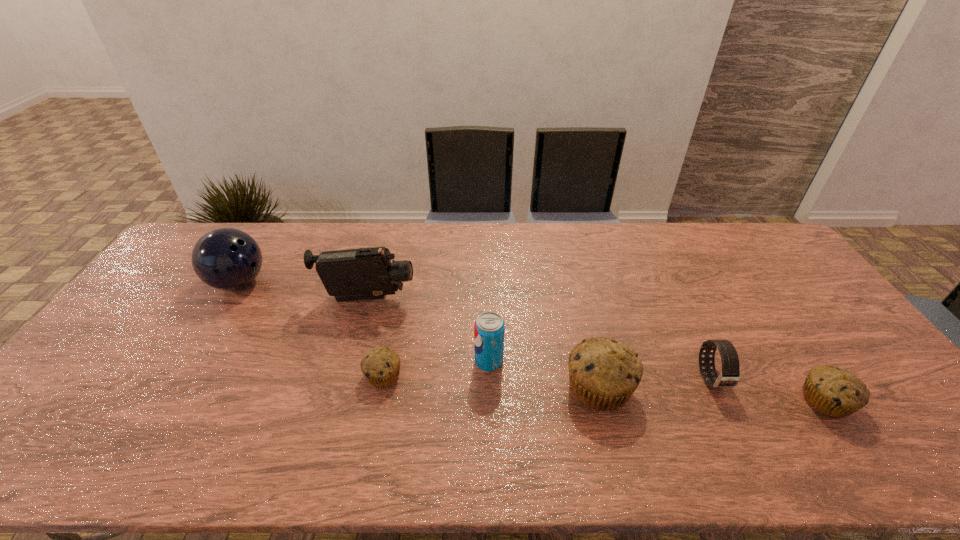
Image resolution: width=960 pixels, height=540 pixels. I want to click on object at the near right corner, so click(835, 392).

In the image, there is a desktop. At what (x,y) coordinates should I click in order to perform the action: click on vacant space at the far edge. Please return your answer as a coordinate pair (x, y). Looking at the image, I should click on (680, 263).

The image size is (960, 540). What are the coordinates of `vacant space at the near edge of the desktop` in the screenshot? It's located at (639, 414).

In the image, there is a desktop. Where is `blank space at the left edge`? The image size is (960, 540). blank space at the left edge is located at coordinates tap(126, 319).

I want to click on vacant space at the right edge of the desktop, so click(826, 354).

Where is `vacant area that lies between the second shortest object and the watch`? The height and width of the screenshot is (540, 960). vacant area that lies between the second shortest object and the watch is located at coordinates (768, 389).

This screenshot has height=540, width=960. Find the location of `free point between the camcorder and the fourth object from right to left`. free point between the camcorder and the fourth object from right to left is located at coordinates (428, 330).

At what (x,y) coordinates should I click in order to perform the action: click on empty space between the fourth object from right to left and the leftmost object. Please return your answer as a coordinate pair (x, y). Looking at the image, I should click on (364, 322).

The width and height of the screenshot is (960, 540). In order to click on vacant point located between the watch and the camcorder in this screenshot , I will do `click(539, 339)`.

The height and width of the screenshot is (540, 960). Find the location of `unoccupied position between the watch and the rightmost object`. unoccupied position between the watch and the rightmost object is located at coordinates (768, 389).